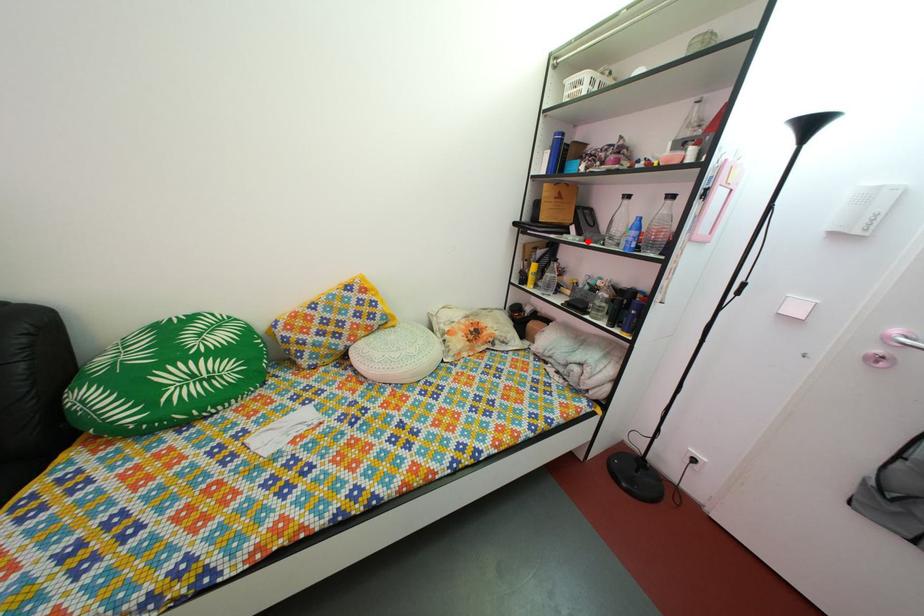
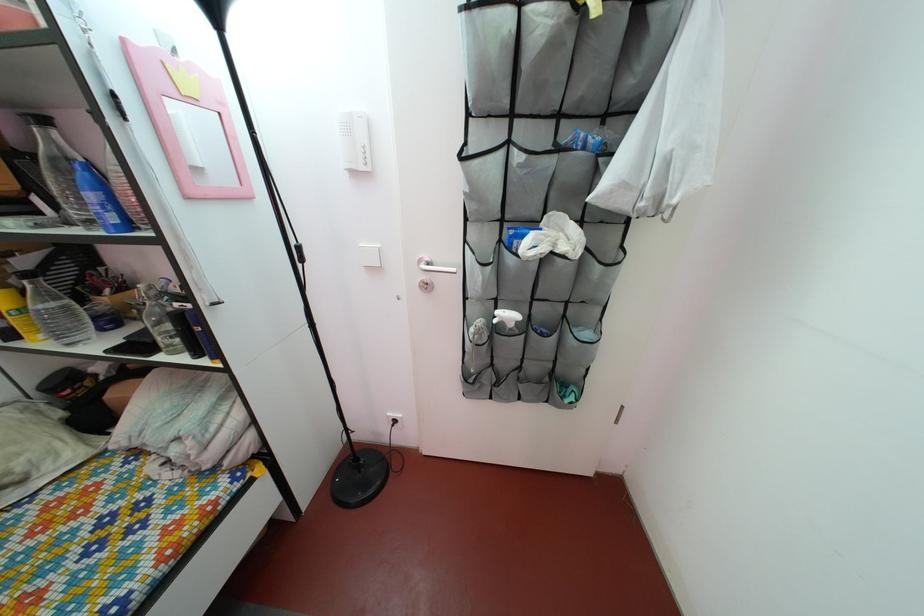
In the second image, find the point that corresponds to the highlighted location in the first image.

(68, 217)